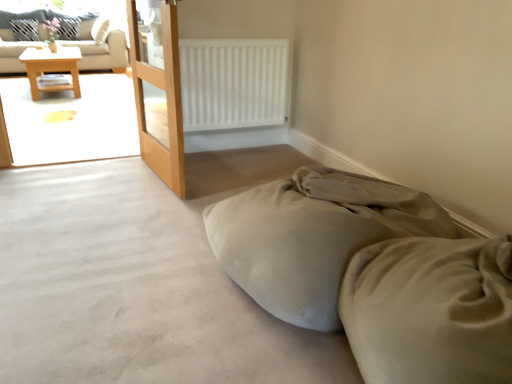
Locate an element on the screen. The width and height of the screenshot is (512, 384). suede-like beige bed at lower right is located at coordinates (372, 274).

The height and width of the screenshot is (384, 512). What are the coordinates of `wooden screen door at left` in the screenshot? It's located at pos(158,88).

What is the approximate width of white fabric pillow at upper left, which appears as the second pillow when viewed from the left?

white fabric pillow at upper left, which appears as the second pillow when viewed from the left, is 9.40 inches wide.

I want to click on wooden table at left, so click(51, 68).

Based on the photo, considering the sizes of wooden table at left and suede-like beige bed at lower right in the image, is wooden table at left taller or shorter than suede-like beige bed at lower right?

wooden table at left is taller than suede-like beige bed at lower right.

Is wooden table at left wider or thinner than suede-like beige bed at lower right?

wooden table at left is wider than suede-like beige bed at lower right.

Is suede-like beige bed at lower right at the back of wooden table at left?

No, wooden table at left is not facing away from suede-like beige bed at lower right.

Which object is further away from the camera taking this photo, wooden table at left or suede-like beige bed at lower right?

wooden table at left is further away from the camera.

Between white matte radiator at upper center and wooden table at left, which one has more height?

white matte radiator at upper center.

Is white matte radiator at upper center not near wooden table at left?

Yes, white matte radiator at upper center and wooden table at left are quite far apart.

Can you tell me how much white matte radiator at upper center and wooden table at left differ in facing direction?

0.000205 degrees.

Choose the correct answer: Is white matte radiator at upper center inside wooden table at left or outside it?

The correct answer is: outside.

Looking at this image, how many degrees apart are the facing directions of white fabric pillow at upper left, which is counted as the first pillow, starting from the left, and suede-like beige bed at lower right?

90 degrees separate the facing orientations of white fabric pillow at upper left, which is counted as the first pillow, starting from the left, and suede-like beige bed at lower right.

Can you confirm if white fabric pillow at upper left, which is counted as the first pillow, starting from the left, is smaller than suede-like beige bed at lower right?

Yes.

Can suede-like beige bed at lower right be found inside white fabric pillow at upper left, which is counted as the first pillow, starting from the left?

No, suede-like beige bed at lower right is located outside of white fabric pillow at upper left, which is counted as the first pillow, starting from the left.

From the image's perspective, does white fabric pillow at upper left, which is counted as the first pillow, starting from the left, appear lower than suede-like beige bed at lower right?

Incorrect, from the image's perspective, white fabric pillow at upper left, which is counted as the first pillow, starting from the left, is higher than suede-like beige bed at lower right.

Does wooden screen door at left touch wooden table at left?

No.

Which of these two, wooden screen door at left or wooden table at left, stands shorter?

wooden table at left.

Considering the sizes of wooden screen door at left and wooden table at left in the image, is wooden screen door at left wider or thinner than wooden table at left?

Clearly, wooden screen door at left has less width compared to wooden table at left.

Is wooden screen door at left positioned with its back to wooden table at left?

wooden screen door at left is not turned away from wooden table at left.

In the scene shown: In the image, is white matte radiator at upper center on the left side or the right side of wooden screen door at left?

Clearly, white matte radiator at upper center is on the right of wooden screen door at left in the image.

Looking at this image, is white matte radiator at upper center wider or thinner than wooden screen door at left?

white matte radiator at upper center is wider than wooden screen door at left.

Between white matte radiator at upper center and wooden screen door at left, which one has more height?

Standing taller between the two is wooden screen door at left.

Considering the positions of objects white matte radiator at upper center and wooden screen door at left in the image provided, who is behind, white matte radiator at upper center or wooden screen door at left?

Positioned behind is white matte radiator at upper center.

From the image's perspective, would you say white fabric pillow at upper left, which appears as the second pillow when viewed from the left, is positioned over white matte radiator at upper center?

Yes, from the image's perspective, white fabric pillow at upper left, which appears as the second pillow when viewed from the left, is on top of white matte radiator at upper center.

Is white fabric pillow at upper left, which is counted as the first pillow, starting from the right, touching white matte radiator at upper center?

No, white fabric pillow at upper left, which is counted as the first pillow, starting from the right, is not in contact with white matte radiator at upper center.

In the scene shown: Can you confirm if white fabric pillow at upper left, which appears as the second pillow when viewed from the left, is taller than white matte radiator at upper center?

In fact, white fabric pillow at upper left, which appears as the second pillow when viewed from the left, may be shorter than white matte radiator at upper center.

Is white fabric pillow at upper left, which is counted as the first pillow, starting from the left, oriented away from wooden screen door at left?

That's not correct — white fabric pillow at upper left, which is counted as the first pillow, starting from the left, is not looking away from wooden screen door at left.

Between white fabric pillow at upper left, which is counted as the first pillow, starting from the left, and wooden screen door at left, which one has larger width?

Wider between the two is white fabric pillow at upper left, which is counted as the first pillow, starting from the left.

Can you see white fabric pillow at upper left, which is counted as the first pillow, starting from the left, touching wooden screen door at left?

No, white fabric pillow at upper left, which is counted as the first pillow, starting from the left, is not touching wooden screen door at left.

Find the location of a particular element. This screenshot has width=512, height=384. bed below the wooden table at left (from the image's perspective) is located at coordinates (372, 274).

The image size is (512, 384). Find the location of `table below the white matte radiator at upper center (from a real-world perspective)`. table below the white matte radiator at upper center (from a real-world perspective) is located at coordinates (51, 68).

Based on their spatial positions, is white matte radiator at upper center or suede-like beige bed at lower right further from wooden table at left?

The object further to wooden table at left is suede-like beige bed at lower right.

From the picture: Which object lies further to the anchor point wooden screen door at left, suede-like beige bed at lower right or white fabric pillow at upper left, which appears as the second pillow when viewed from the left?

white fabric pillow at upper left, which appears as the second pillow when viewed from the left, is further to wooden screen door at left.

When comparing their distances from white fabric pillow at upper left, which is the second pillow in right-to-left order, does white fabric pillow at upper left, which appears as the second pillow when viewed from the left, or white matte radiator at upper center seem closer?

Among the two, white fabric pillow at upper left, which appears as the second pillow when viewed from the left, is located nearer to white fabric pillow at upper left, which is the second pillow in right-to-left order.

Considering their positions, is white matte radiator at upper center positioned closer to beige fabric couch at upper left than wooden screen door at left?

white matte radiator at upper center lies closer to beige fabric couch at upper left than the other object.

Looking at the image, which one is located further to white fabric pillow at upper left, which is counted as the first pillow, starting from the right, beige fabric couch at upper left or wooden table at left?

Based on the image, wooden table at left appears to be further to white fabric pillow at upper left, which is counted as the first pillow, starting from the right.

Which object lies further to the anchor point white fabric pillow at upper left, which is counted as the first pillow, starting from the right, suede-like beige bed at lower right or white matte radiator at upper center?

suede-like beige bed at lower right is further to white fabric pillow at upper left, which is counted as the first pillow, starting from the right.

From the image, which object appears to be nearer to white fabric pillow at upper left, which is counted as the first pillow, starting from the right, suede-like beige bed at lower right or beige fabric couch at upper left?

Based on the image, beige fabric couch at upper left appears to be nearer to white fabric pillow at upper left, which is counted as the first pillow, starting from the right.

Looking at the image, which one is located further to beige fabric couch at upper left, wooden screen door at left or white fabric pillow at upper left, which is counted as the first pillow, starting from the right?

wooden screen door at left.

You are a GUI agent. You are given a task and a screenshot of the screen. Output one action in this format:
    pyautogui.click(x=<x>, y=<y>)
    Task: Click on the studio couch between wooden table at left and white fabric pillow at upper left, which appears as the second pillow when viewed from the left, from front to back
    Image resolution: width=512 pixels, height=384 pixels.
    Given the screenshot: What is the action you would take?
    pyautogui.click(x=100, y=47)

You are a GUI agent. You are given a task and a screenshot of the screen. Output one action in this format:
    pyautogui.click(x=<x>, y=<y>)
    Task: Click on the radiator between wooden screen door at left and white fabric pillow at upper left, which is the second pillow in right-to-left order, in the front-back direction
    This screenshot has width=512, height=384.
    Given the screenshot: What is the action you would take?
    pyautogui.click(x=234, y=83)

Locate an element on the screen. pillow between white matte radiator at upper center and white fabric pillow at upper left, which is counted as the first pillow, starting from the right, in the front-back direction is located at coordinates (25, 29).

Image resolution: width=512 pixels, height=384 pixels. Find the location of `pillow located between wooden table at left and white fabric pillow at upper left, which appears as the second pillow when viewed from the left, in the depth direction`. pillow located between wooden table at left and white fabric pillow at upper left, which appears as the second pillow when viewed from the left, in the depth direction is located at coordinates (25, 29).